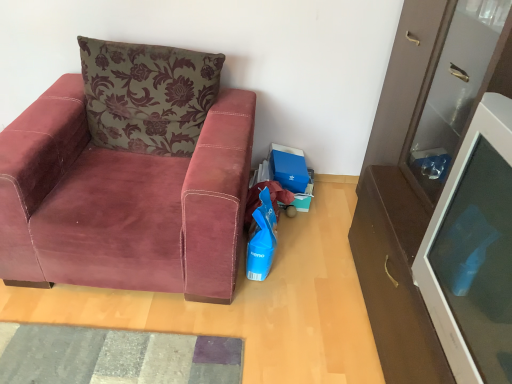
Question: Is velvet maroon armchair at left in front of velvet floral pillow at upper left?

Choices:
 (A) no
 (B) yes

Answer: (B)

Question: Considering the relative positions of velvet maroon armchair at left and velvet floral pillow at upper left in the image provided, is velvet maroon armchair at left to the right of velvet floral pillow at upper left from the viewer's perspective?

Choices:
 (A) no
 (B) yes

Answer: (A)

Question: Is velvet floral pillow at upper left a part of velvet maroon armchair at left?

Choices:
 (A) no
 (B) yes

Answer: (B)

Question: Considering the relative sizes of velvet maroon armchair at left and velvet floral pillow at upper left in the image provided, is velvet maroon armchair at left wider than velvet floral pillow at upper left?

Choices:
 (A) no
 (B) yes

Answer: (B)

Question: From a real-world perspective, is velvet maroon armchair at left on top of velvet floral pillow at upper left?

Choices:
 (A) no
 (B) yes

Answer: (A)

Question: Is velvet floral pillow at upper left in front of or behind white glossy cabinet at right in the image?

Choices:
 (A) behind
 (B) front

Answer: (A)

Question: Considering the positions of velvet floral pillow at upper left and white glossy cabinet at right in the image, is velvet floral pillow at upper left wider or thinner than white glossy cabinet at right?

Choices:
 (A) thin
 (B) wide

Answer: (A)

Question: Looking at the image, does velvet floral pillow at upper left seem bigger or smaller compared to white glossy cabinet at right?

Choices:
 (A) small
 (B) big

Answer: (A)

Question: From the image's perspective, is velvet floral pillow at upper left positioned above or below white glossy cabinet at right?

Choices:
 (A) below
 (B) above

Answer: (B)

Question: Which is correct: textured gray mat at lower left is inside velvet floral pillow at upper left, or outside of it?

Choices:
 (A) outside
 (B) inside

Answer: (A)

Question: In the image, is textured gray mat at lower left on the left side or the right side of velvet floral pillow at upper left?

Choices:
 (A) left
 (B) right

Answer: (A)

Question: In terms of size, does textured gray mat at lower left appear bigger or smaller than velvet floral pillow at upper left?

Choices:
 (A) big
 (B) small

Answer: (B)

Question: From a real-world perspective, relative to velvet floral pillow at upper left, is textured gray mat at lower left vertically above or below?

Choices:
 (A) below
 (B) above

Answer: (A)

Question: Based on their positions, is velvet maroon armchair at left located to the left or right of velvet floral pillow at upper left?

Choices:
 (A) left
 (B) right

Answer: (A)

Question: Would you say velvet maroon armchair at left is inside or outside velvet floral pillow at upper left?

Choices:
 (A) inside
 (B) outside

Answer: (B)